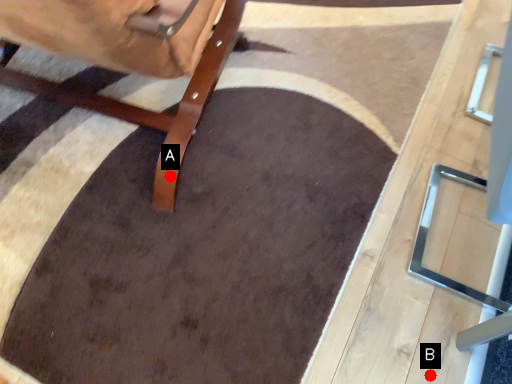
Question: Two points are circled on the image, labeled by A and B beside each circle. Which of the following is the farthest from the observer?

Choices:
 (A) A is further
 (B) B is further

Answer: (A)